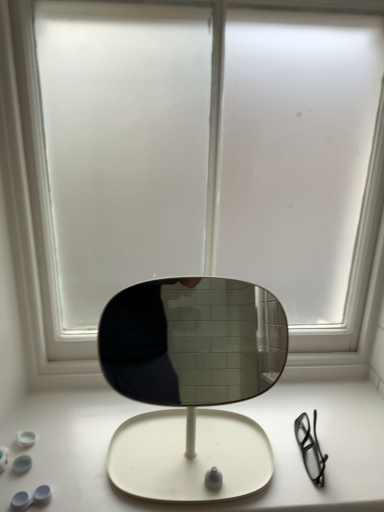
Question: Is frosted glass window at center completely or partially outside of white matte table at center?

Choices:
 (A) yes
 (B) no

Answer: (A)

Question: Does frosted glass window at center have a smaller size compared to white matte table at center?

Choices:
 (A) yes
 (B) no

Answer: (B)

Question: Is the position of frosted glass window at center less distant than that of white matte table at center?

Choices:
 (A) no
 (B) yes

Answer: (B)

Question: Can you confirm if frosted glass window at center is taller than white matte table at center?

Choices:
 (A) no
 (B) yes

Answer: (B)

Question: From a real-world perspective, is frosted glass window at center located higher than white matte table at center?

Choices:
 (A) no
 (B) yes

Answer: (B)

Question: Would you say frosted glass window at center contains white matte table at center?

Choices:
 (A) no
 (B) yes

Answer: (A)

Question: Considering the relative sizes of white matte table at center and frosted glass window at center in the image provided, is white matte table at center wider than frosted glass window at center?

Choices:
 (A) yes
 (B) no

Answer: (A)

Question: Can you confirm if white matte table at center is thinner than frosted glass window at center?

Choices:
 (A) yes
 (B) no

Answer: (B)

Question: Is white matte table at center positioned beyond the bounds of frosted glass window at center?

Choices:
 (A) no
 (B) yes

Answer: (B)

Question: Considering the relative positions of white matte table at center and frosted glass window at center in the image provided, is white matte table at center to the right of frosted glass window at center from the viewer's perspective?

Choices:
 (A) yes
 (B) no

Answer: (B)

Question: Considering the relative positions of white matte table at center and frosted glass window at center in the image provided, is white matte table at center behind frosted glass window at center?

Choices:
 (A) no
 (B) yes

Answer: (B)

Question: From the image's perspective, does white matte table at center appear lower than frosted glass window at center?

Choices:
 (A) no
 (B) yes

Answer: (B)

Question: From a real-world perspective, relative to frosted glass window at center, is white matte table at center vertically above or below?

Choices:
 (A) below
 (B) above

Answer: (A)